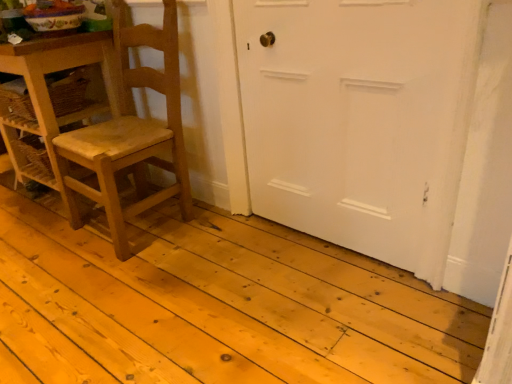
Question: From a real-world perspective, is natural wood floor at center physically above wooden chair at left?

Choices:
 (A) yes
 (B) no

Answer: (B)

Question: Does natural wood floor at center turn towards wooden chair at left?

Choices:
 (A) yes
 (B) no

Answer: (B)

Question: Is natural wood floor at center thinner than wooden chair at left?

Choices:
 (A) no
 (B) yes

Answer: (A)

Question: Is wooden chair at left inside natural wood floor at center?

Choices:
 (A) yes
 (B) no

Answer: (B)

Question: Considering the relative positions of natural wood floor at center and wooden chair at left in the image provided, is natural wood floor at center behind wooden chair at left?

Choices:
 (A) no
 (B) yes

Answer: (A)

Question: From the image's perspective, is natural wood floor at center above wooden chair at left?

Choices:
 (A) yes
 (B) no

Answer: (B)

Question: Does wooden chair at left appear on the left side of white matte door at center?

Choices:
 (A) yes
 (B) no

Answer: (A)

Question: Would you say wooden chair at left is outside white matte door at center?

Choices:
 (A) no
 (B) yes

Answer: (B)

Question: Is wooden chair at left placed right next to white matte door at center?

Choices:
 (A) no
 (B) yes

Answer: (A)

Question: Does wooden chair at left have a lesser width compared to white matte door at center?

Choices:
 (A) yes
 (B) no

Answer: (B)

Question: From a real-world perspective, is wooden chair at left on top of white matte door at center?

Choices:
 (A) no
 (B) yes

Answer: (B)

Question: From a real-world perspective, is wooden chair at left positioned under white matte door at center based on gravity?

Choices:
 (A) no
 (B) yes

Answer: (A)

Question: Is natural wood floor at center completely or partially outside of wooden table at left?

Choices:
 (A) yes
 (B) no

Answer: (A)